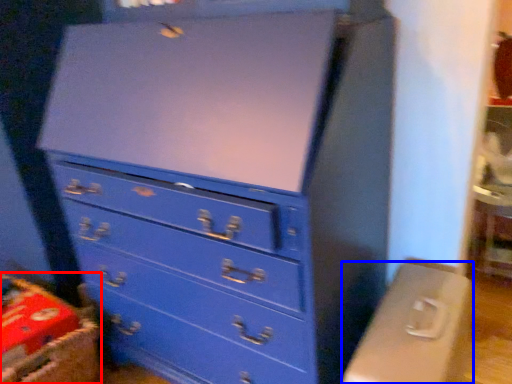
Question: Which object appears closest to the camera in this image, crate (highlighted by a red box) or computer desk (highlighted by a blue box)?

Choices:
 (A) crate
 (B) computer desk

Answer: (B)